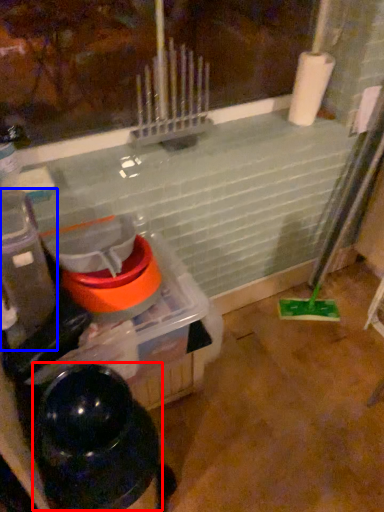
Question: Which object is further to the camera taking this photo, water heater (highlighted by a red box) or appliance (highlighted by a blue box)?

Choices:
 (A) water heater
 (B) appliance

Answer: (B)